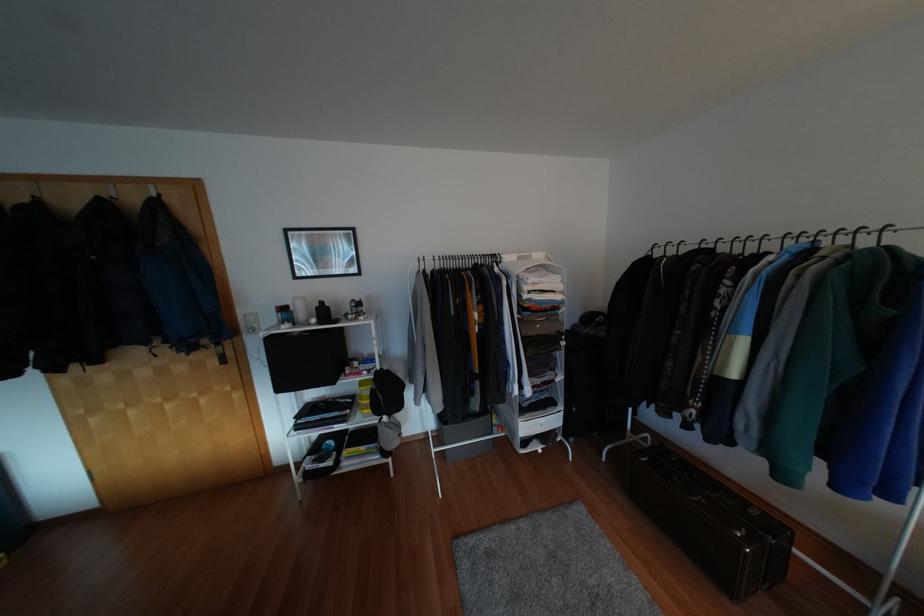
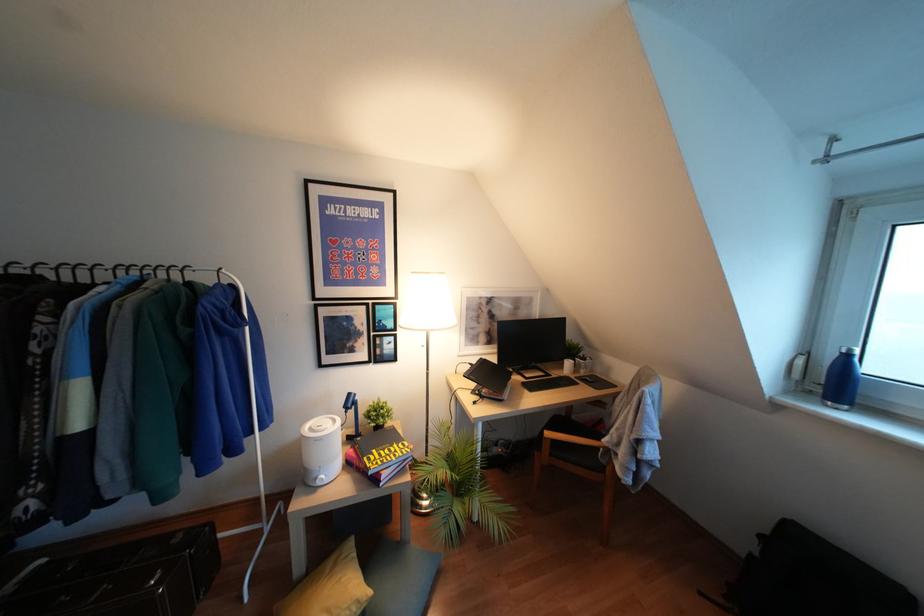
Question: Based on the continuous images, in which direction is the camera rotating? Reply with the corresponding letter.

Choices:
 (A) Left
 (B) Right
 (C) Up
 (D) Down

Answer: (B)